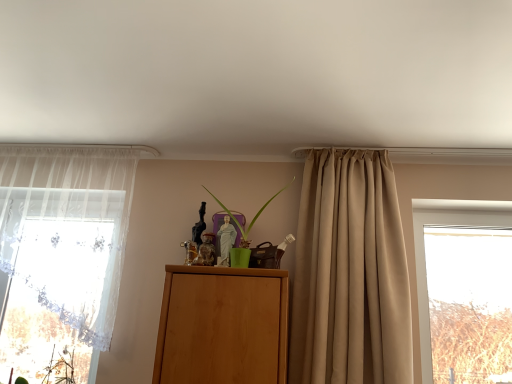
Question: Is sheer white curtain at left, the second curtain viewed from the right, far from green matte plant at center?

Choices:
 (A) yes
 (B) no

Answer: (B)

Question: Can you confirm if sheer white curtain at left, the second curtain viewed from the right, is positioned to the right of green matte plant at center?

Choices:
 (A) yes
 (B) no

Answer: (B)

Question: Does sheer white curtain at left, positioned as the 1th curtain in left-to-right order, have a greater height compared to green matte plant at center?

Choices:
 (A) no
 (B) yes

Answer: (B)

Question: From a real-world perspective, is sheer white curtain at left, the second curtain viewed from the right, on top of green matte plant at center?

Choices:
 (A) no
 (B) yes

Answer: (A)

Question: Considering the relative sizes of sheer white curtain at left, positioned as the 1th curtain in left-to-right order, and green matte plant at center in the image provided, is sheer white curtain at left, positioned as the 1th curtain in left-to-right order, bigger than green matte plant at center?

Choices:
 (A) yes
 (B) no

Answer: (A)

Question: Can you confirm if sheer white curtain at left, the second curtain viewed from the right, is shorter than green matte plant at center?

Choices:
 (A) yes
 (B) no

Answer: (B)

Question: Is sheer white curtain at left, positioned as the 1th curtain in left-to-right order, facing away from beige satin curtain at center, which appears as the 2th curtain when viewed from the left?

Choices:
 (A) no
 (B) yes

Answer: (A)

Question: Does sheer white curtain at left, positioned as the 1th curtain in left-to-right order, have a larger size compared to beige satin curtain at center, which appears as the 2th curtain when viewed from the left?

Choices:
 (A) yes
 (B) no

Answer: (B)

Question: Can you confirm if sheer white curtain at left, positioned as the 1th curtain in left-to-right order, is taller than beige satin curtain at center, the 1th curtain in the right-to-left sequence?

Choices:
 (A) no
 (B) yes

Answer: (A)

Question: Can you confirm if sheer white curtain at left, the second curtain viewed from the right, is wider than beige satin curtain at center, which appears as the 2th curtain when viewed from the left?

Choices:
 (A) yes
 (B) no

Answer: (B)

Question: Does sheer white curtain at left, the second curtain viewed from the right, lie behind beige satin curtain at center, the 1th curtain in the right-to-left sequence?

Choices:
 (A) yes
 (B) no

Answer: (A)

Question: Is sheer white curtain at left, positioned as the 1th curtain in left-to-right order, beside beige satin curtain at center, which appears as the 2th curtain when viewed from the left?

Choices:
 (A) no
 (B) yes

Answer: (A)

Question: Does beige satin curtain at center, which appears as the 2th curtain when viewed from the left, have a larger size compared to sheer white curtain at left, the second curtain viewed from the right?

Choices:
 (A) no
 (B) yes

Answer: (B)